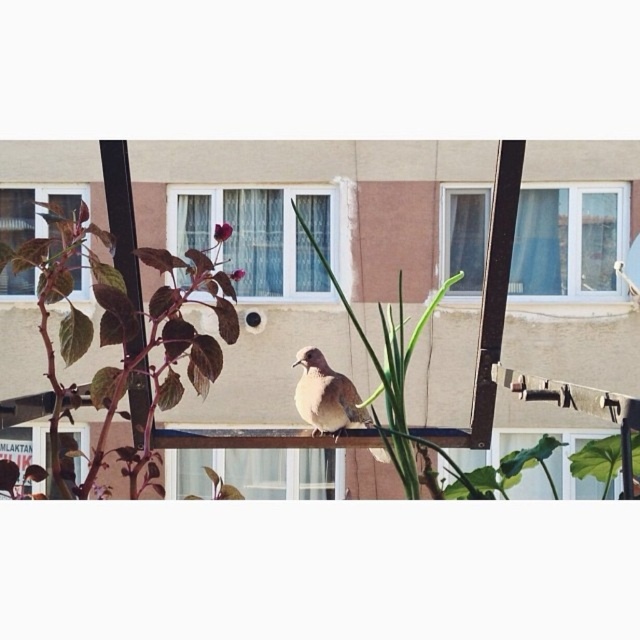
You are standing on the balcony and want to place a small potted plant between the two points marked as point (209, 356) and point (365, 337). Which point should the plant be closer to in order to be nearer to the bird?

The plant should be placed closer to point (209, 356) because it is closer to the viewer than point (365, 337), meaning it is physically nearer to the bird perched on the metal bar.

You are standing on the balcony and want to locate the shiny purple leaves at left. According to the coordinates provided, where exactly should you look?

The shiny purple leaves at left are located at point (120, 339).